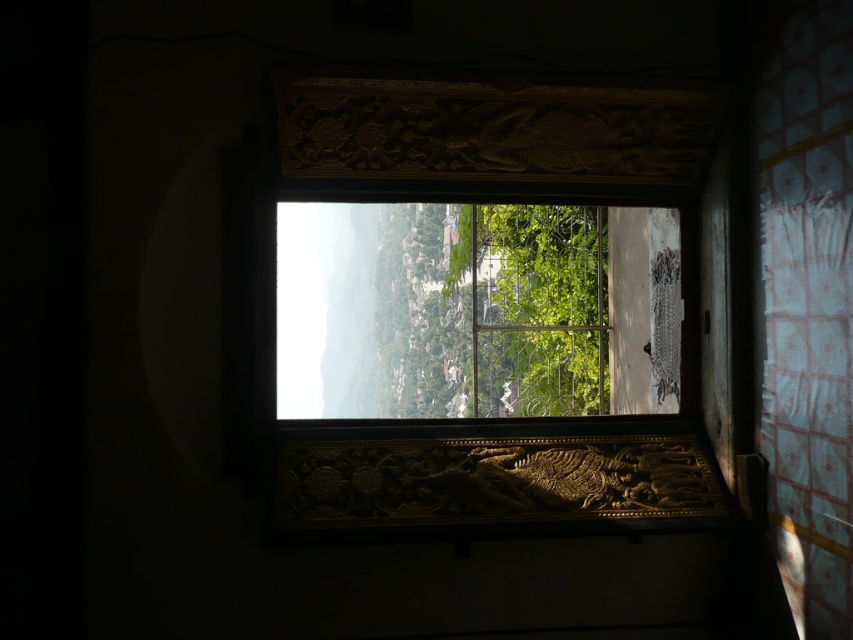
Question: Which point is closer to the camera?

Choices:
 (A) gold carved wood at center
 (B) green leafy tree at center

Answer: (A)

Question: Which of the following is the farthest from the observer?

Choices:
 (A) green leafy tree at center
 (B) gold carved wood at center

Answer: (A)

Question: Does gold carved wood at center have a smaller size compared to green leafy tree at center?

Choices:
 (A) yes
 (B) no

Answer: (A)

Question: Does gold carved wood at center have a lesser width compared to green leafy tree at center?

Choices:
 (A) no
 (B) yes

Answer: (A)

Question: Is gold carved wood at center to the right of green leafy tree at center from the viewer's perspective?

Choices:
 (A) no
 (B) yes

Answer: (B)